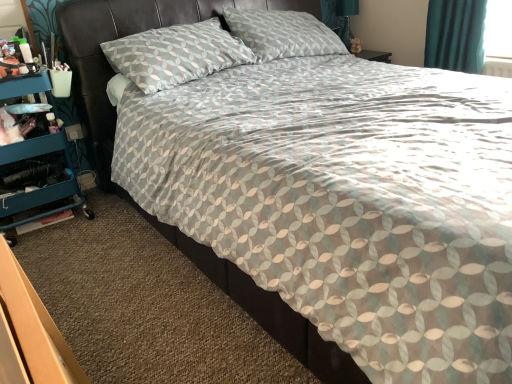
This screenshot has width=512, height=384. I want to click on free area below teal plastic cart at left (from a real-world perspective), so click(39, 228).